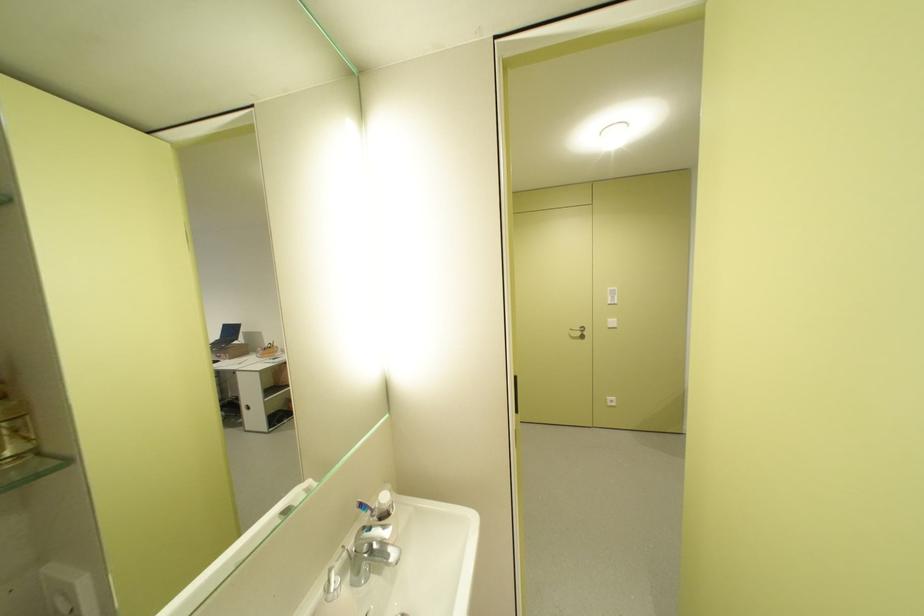
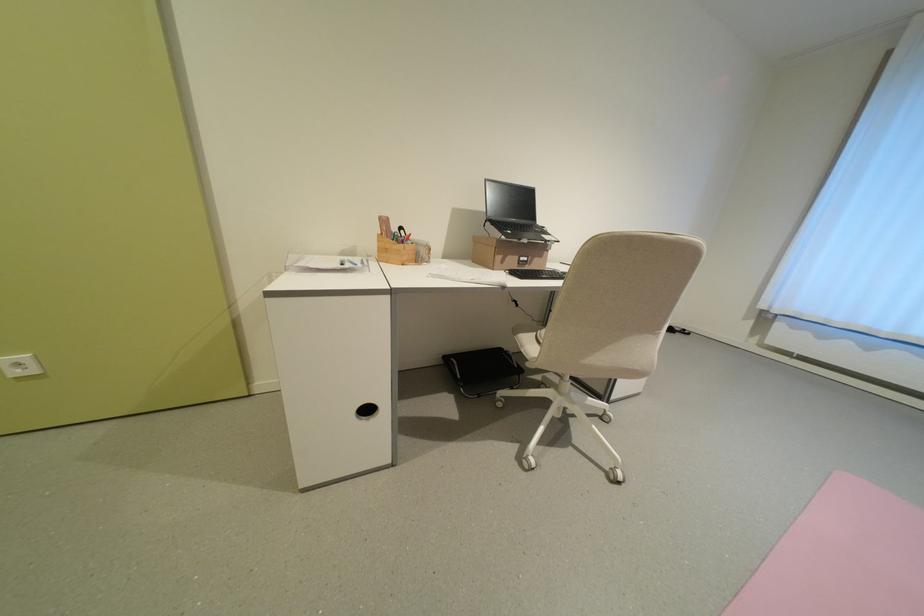
Find the pixel in the second image that matches point (623, 406) in the first image.

(43, 371)